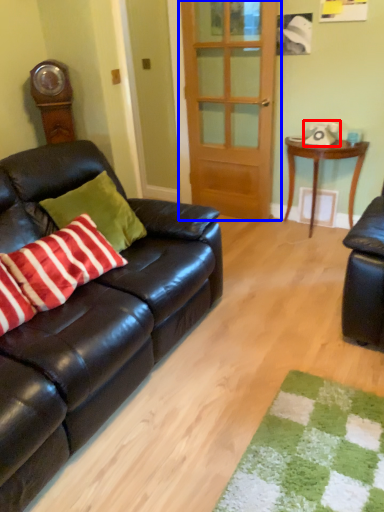
Question: Which point is further to the camera, corded phone (highlighted by a red box) or door (highlighted by a blue box)?

Choices:
 (A) corded phone
 (B) door

Answer: (A)